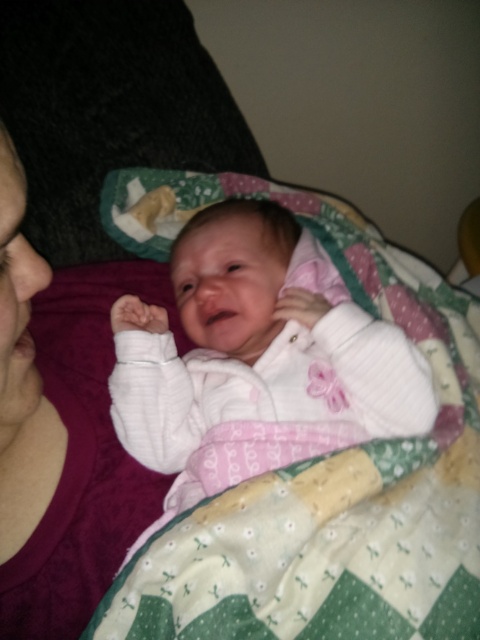
What is the exact position of the white soft baby at center in the image?

The white soft baby at center is located at point (255,358).

You are a photographer setting up for a baby photo shoot. You have a white soft baby at center and a matte purple fabric at left in the frame. Based on the scene, which object takes up more area in the image?

The matte purple fabric at left occupies more space in the image than the white soft baby at center, as the baby takes up less area.

You are a photographer setting up a shoot with a white soft baby at center and a matte purple fabric at left. The baby needs to be moved closer to the camera. Which direction should you move the baby to keep it centered while moving it forward?

You should move the white soft baby at center forward while keeping it centered, ensuring it remains aligned with the original position but closer to the camera.